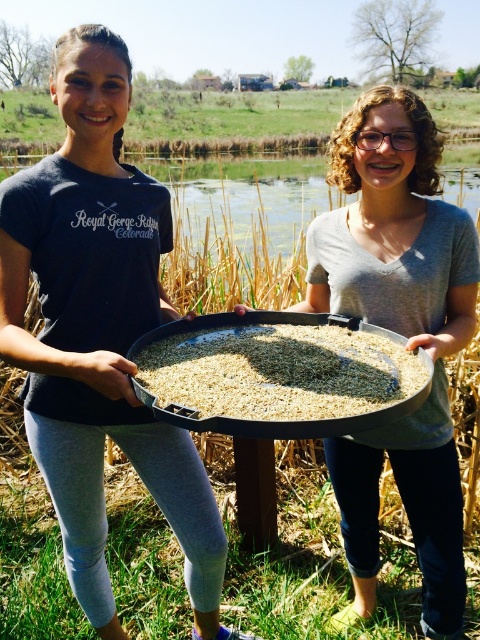
Question: Among these objects, which one is farthest from the camera?

Choices:
 (A) matte black tray at left
 (B) brown matte rice at center

Answer: (A)

Question: Based on their relative distances, which object is nearer to the brown matte rice at center?

Choices:
 (A) matte black tray at left
 (B) matte gray tray at center

Answer: (A)

Question: Is matte gray tray at center to the right of brown matte rice at center from the viewer's perspective?

Choices:
 (A) no
 (B) yes

Answer: (B)

Question: Does matte black tray at left have a larger size compared to brown matte rice at center?

Choices:
 (A) no
 (B) yes

Answer: (B)

Question: Which object is the farthest from the matte black tray at left?

Choices:
 (A) matte gray tray at center
 (B) brown matte rice at center

Answer: (A)

Question: Does matte black tray at left have a larger size compared to brown matte rice at center?

Choices:
 (A) yes
 (B) no

Answer: (A)